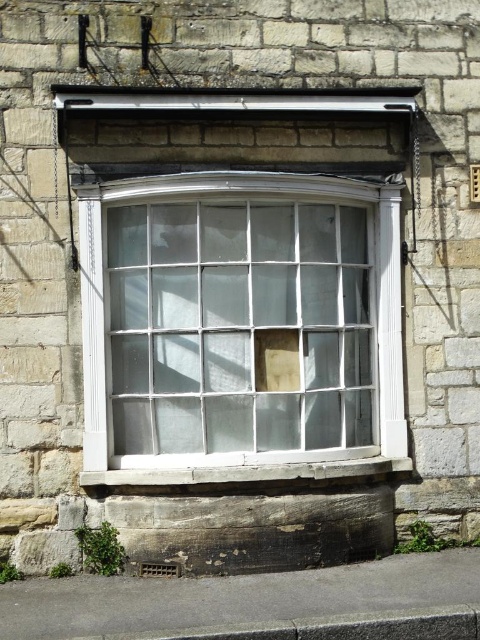
Question: Which point is farther to the camera?

Choices:
 (A) clear glass window at center
 (B) smooth stone window sill at center

Answer: (A)

Question: Where is clear glass window at center located in relation to smooth stone window sill at center in the image?

Choices:
 (A) right
 (B) left

Answer: (B)

Question: Which point appears closest to the camera in this image?

Choices:
 (A) (249, 477)
 (B) (275, 272)

Answer: (A)

Question: Considering the relative positions of clear glass window at center and smooth stone window sill at center in the image provided, where is clear glass window at center located with respect to smooth stone window sill at center?

Choices:
 (A) right
 (B) left

Answer: (B)

Question: In this image, where is clear glass window at center located relative to smooth stone window sill at center?

Choices:
 (A) above
 (B) below

Answer: (A)